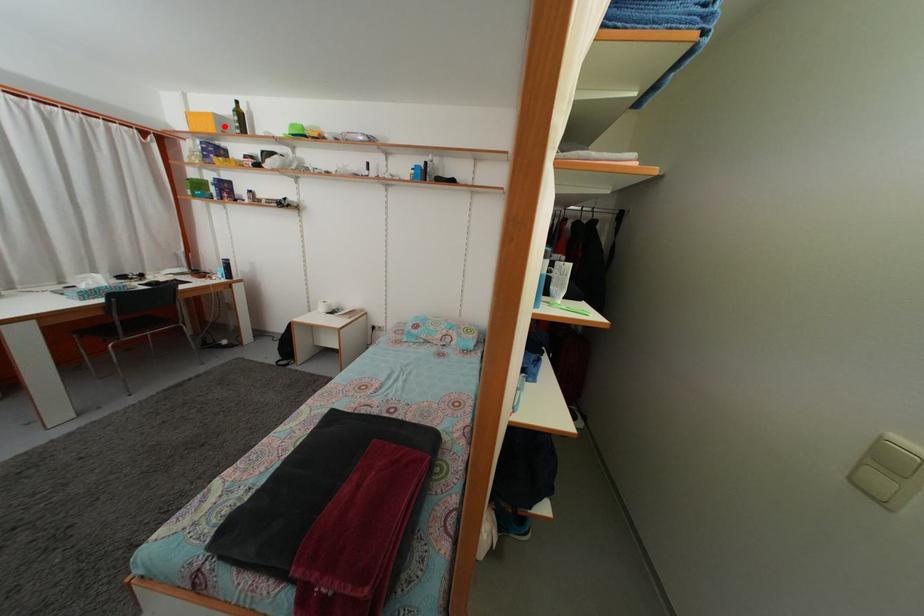
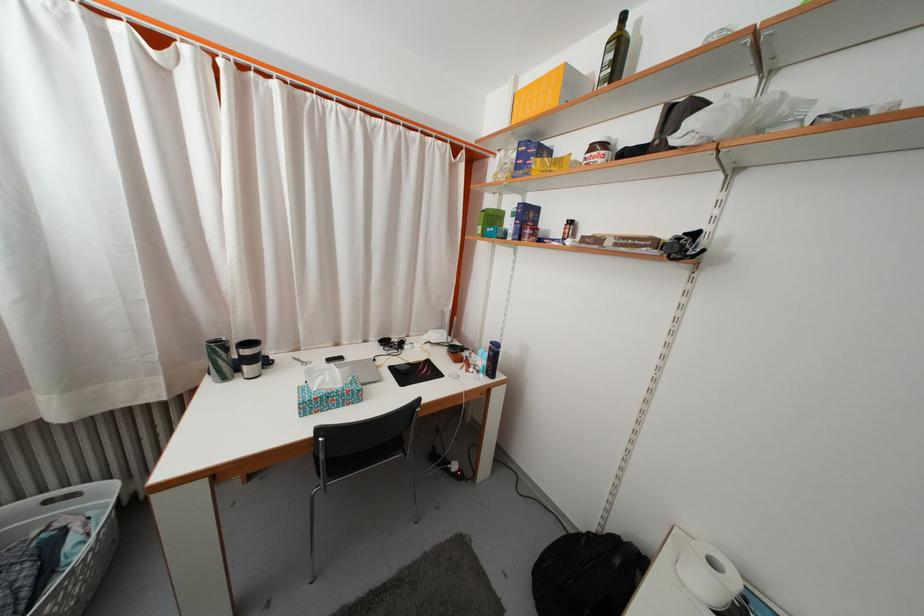
The point at the highlighted location is marked in the first image. Where is the corresponding point in the second image?

(575, 84)